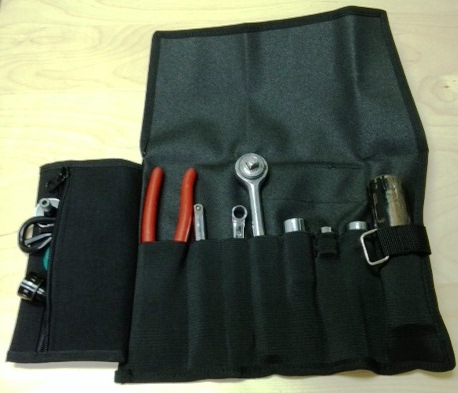
At what (x,y) coordinates should I click in order to perform the action: click on the fifth slot of the cloth compartment from left to right. Please return your answer as a coordinate pair (x, y). The height and width of the screenshot is (393, 458). Looking at the image, I should click on (301, 300).